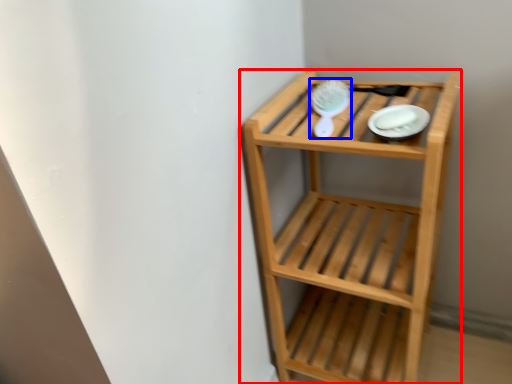
Question: Which of the following is the farthest to the observer, shelf (highlighted by a red box) or brush (highlighted by a blue box)?

Choices:
 (A) shelf
 (B) brush

Answer: (B)